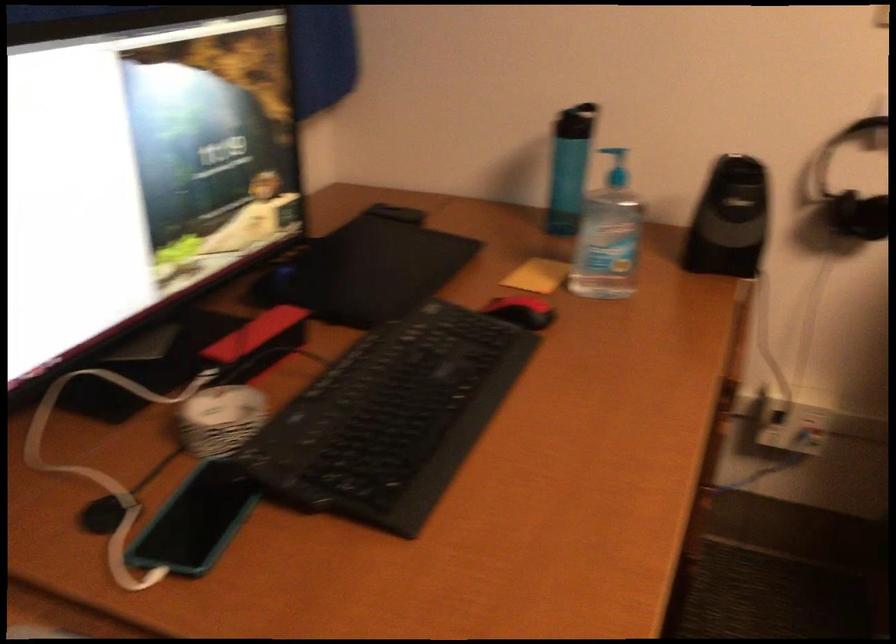
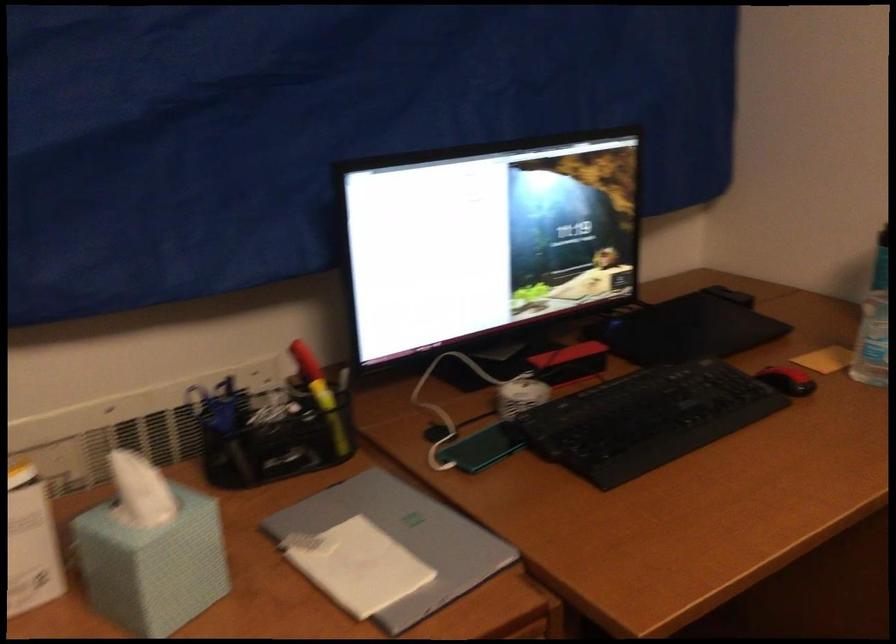
Locate, in the second image, the point that corresponds to point 530,310 in the first image.

(787, 380)